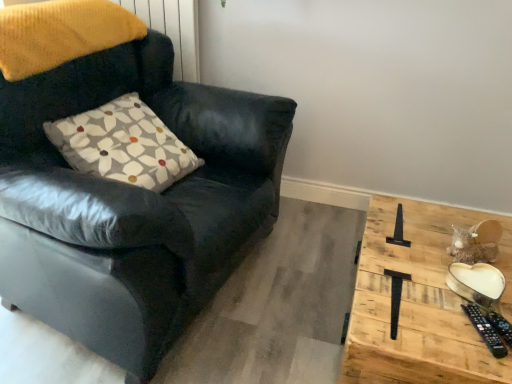
Question: Is matte black armchair at left at the back of white printed cushion at upper left?

Choices:
 (A) yes
 (B) no

Answer: (A)

Question: From a real-world perspective, is white printed cushion at upper left positioned over matte black armchair at left based on gravity?

Choices:
 (A) yes
 (B) no

Answer: (A)

Question: Considering the relative sizes of white printed cushion at upper left and matte black armchair at left in the image provided, is white printed cushion at upper left thinner than matte black armchair at left?

Choices:
 (A) no
 (B) yes

Answer: (B)

Question: Could you tell me if white printed cushion at upper left is facing matte black armchair at left?

Choices:
 (A) yes
 (B) no

Answer: (A)

Question: Considering the relative sizes of white printed cushion at upper left and matte black armchair at left in the image provided, is white printed cushion at upper left smaller than matte black armchair at left?

Choices:
 (A) no
 (B) yes

Answer: (B)

Question: Is white printed cushion at upper left far away from matte black armchair at left?

Choices:
 (A) no
 (B) yes

Answer: (A)

Question: Does white printed cushion at upper left lie in front of wooden heart-shaped plate at right?

Choices:
 (A) no
 (B) yes

Answer: (A)

Question: Is white printed cushion at upper left at the left side of wooden heart-shaped plate at right?

Choices:
 (A) no
 (B) yes

Answer: (B)

Question: From a real-world perspective, is white printed cushion at upper left on wooden heart-shaped plate at right?

Choices:
 (A) no
 (B) yes

Answer: (B)

Question: Considering the relative sizes of white printed cushion at upper left and wooden heart-shaped plate at right in the image provided, is white printed cushion at upper left shorter than wooden heart-shaped plate at right?

Choices:
 (A) yes
 (B) no

Answer: (A)

Question: From the image's perspective, is white printed cushion at upper left beneath wooden heart-shaped plate at right?

Choices:
 (A) no
 (B) yes

Answer: (A)

Question: From a real-world perspective, is white printed cushion at upper left under wooden heart-shaped plate at right?

Choices:
 (A) yes
 (B) no

Answer: (B)

Question: Considering the relative sizes of matte black armchair at left and wooden heart-shaped plate at right in the image provided, is matte black armchair at left bigger than wooden heart-shaped plate at right?

Choices:
 (A) no
 (B) yes

Answer: (B)